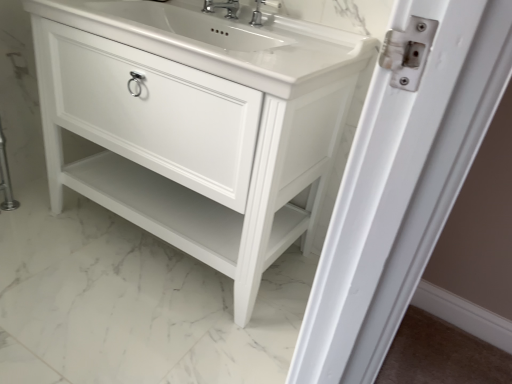
The image size is (512, 384). I want to click on vacant space to the left of polished chrome faucet at upper center, the 2th tap from the right, so click(x=180, y=13).